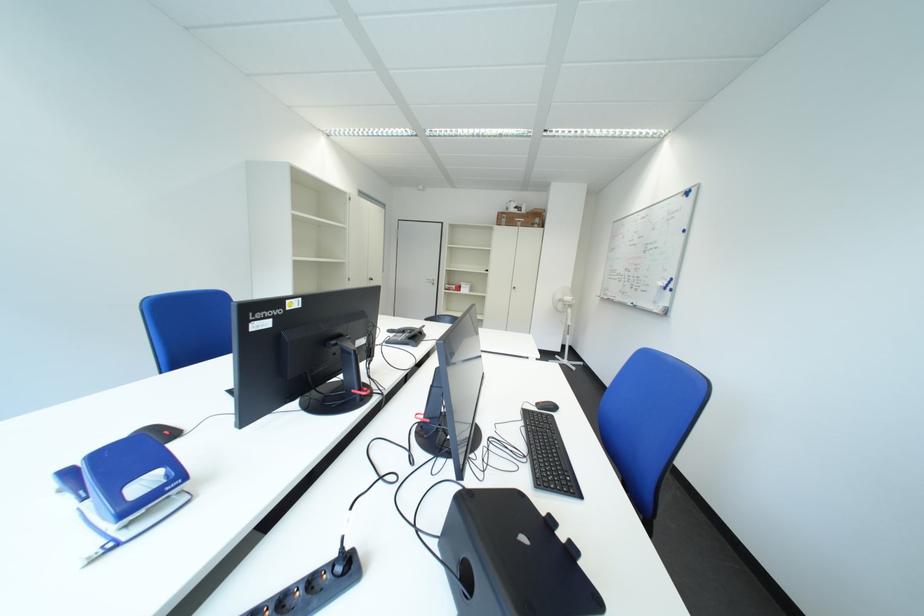
Identify the location of blue hole punch lever. (129, 488).